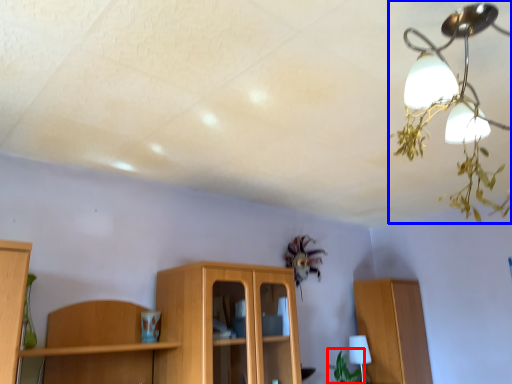
Question: Which object is closer to the camera taking this photo, plant (highlighted by a red box) or lamp (highlighted by a blue box)?

Choices:
 (A) plant
 (B) lamp

Answer: (B)